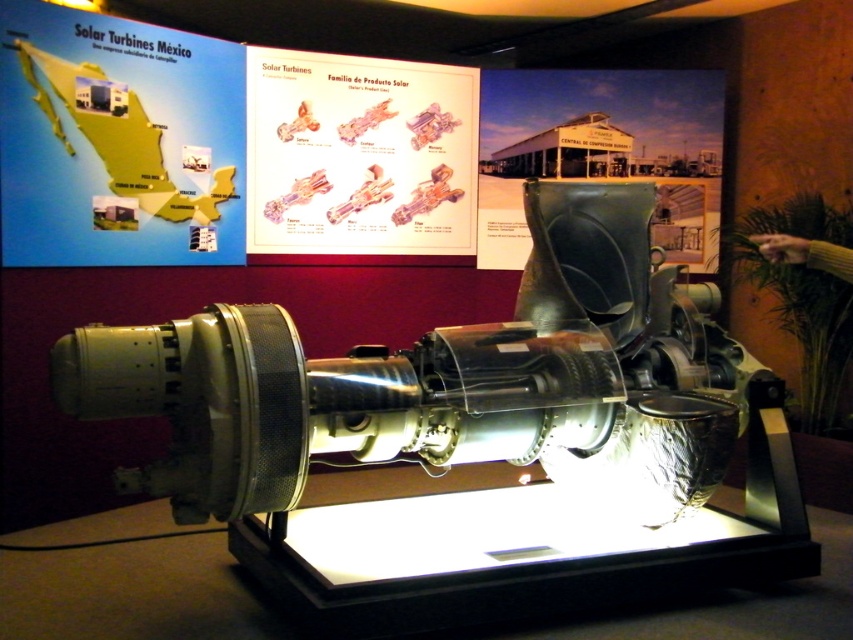
Which is in front, point (198, 218) or point (399, 202)?

Point (198, 218) is more forward.

Which of these two, blue map at upper left or matte metallic engine at center, stands taller?

blue map at upper left is taller.

Is point (222, 253) positioned behind point (320, 243)?

No, it is not.

Locate an element on the screen. This screenshot has height=640, width=853. blue map at upper left is located at coordinates (117, 141).

Who is taller, blue map at upper left or green matte sign at upper center?

green matte sign at upper center is taller.

Is point (80, 202) positioned before point (680, 200)?

Yes, point (80, 202) is closer to viewer.

Between point (19, 131) and point (480, 92), which one is positioned in front?

Point (19, 131) is more forward.

Find the location of a particular element. The height and width of the screenshot is (640, 853). blue map at upper left is located at coordinates (117, 141).

Does matte metallic engine at center appear on the right side of green matte sign at upper center?

In fact, matte metallic engine at center is to the left of green matte sign at upper center.

Which is in front, point (303, 180) or point (503, 134)?

Point (303, 180) is more forward.

Between point (289, 160) and point (497, 81), which one is positioned behind?

Positioned behind is point (497, 81).

Find the location of a particular element. The width and height of the screenshot is (853, 640). matte metallic engine at center is located at coordinates (358, 154).